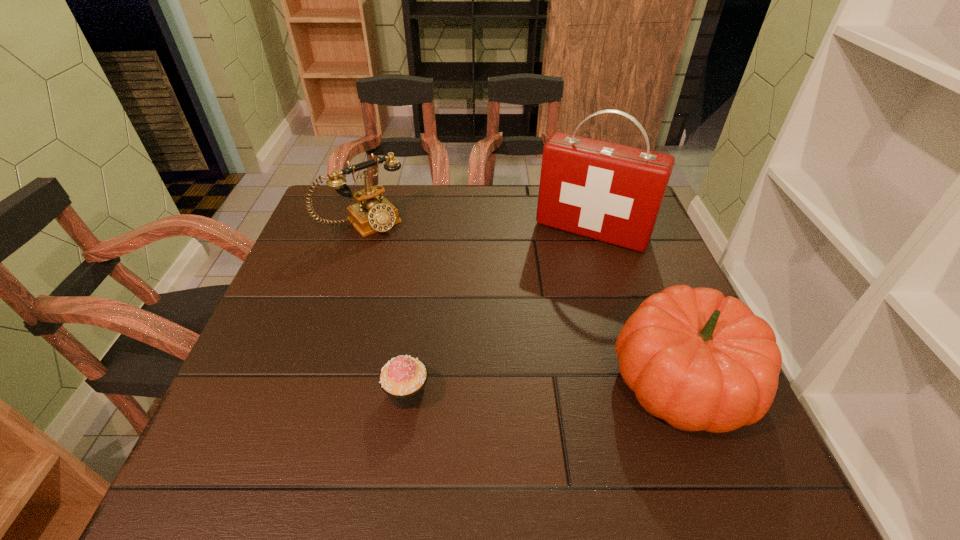
Locate an element on the screen. Image resolution: width=960 pixels, height=540 pixels. free space on the desktop that is between the shortest object and the pumpkin and is positioned on the dial number of the leftmost object is located at coordinates (518, 388).

Locate an element on the screen. vacant spot on the desktop that is between the cupcake and the pumpkin and is positioned on the front face of the tallest object is located at coordinates point(511,388).